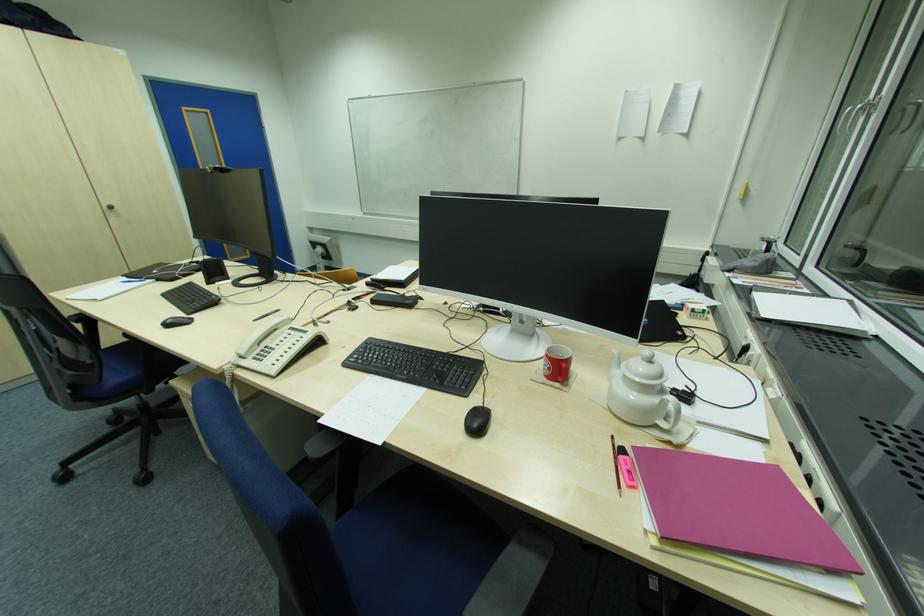
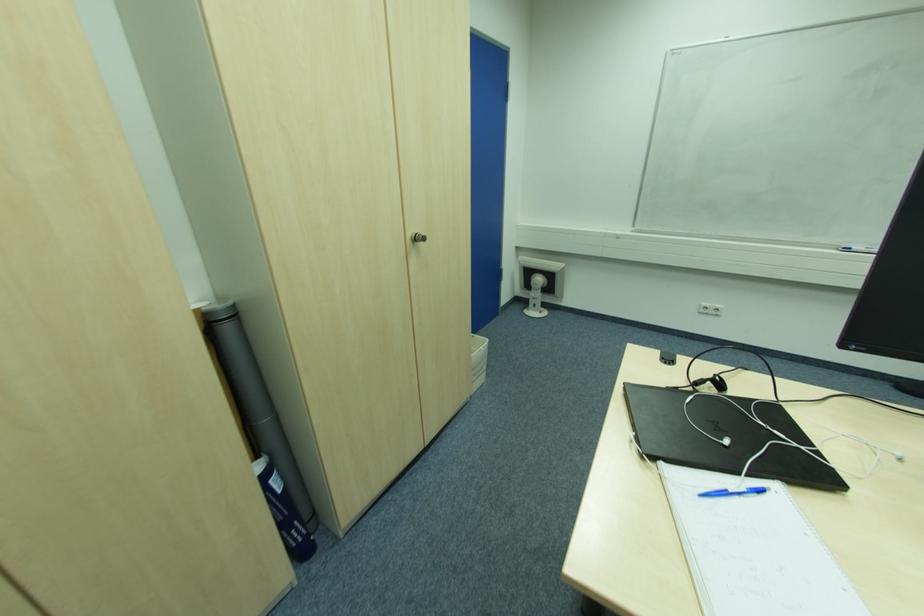
Find the pixel in the second image that matches pixel 157 273 in the first image.

(728, 443)